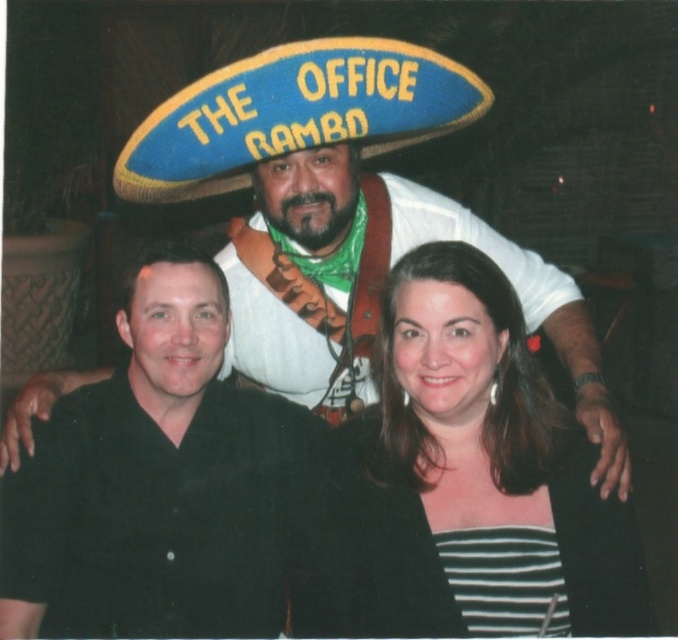
Which of these two, matte black blazer at center or white matte sombrero at upper center, stands shorter?

matte black blazer at center

Who is more distant from viewer, (388,291) or (521,280)?

Positioned behind is point (521,280).

Image resolution: width=678 pixels, height=640 pixels. I want to click on matte black blazer at center, so click(x=460, y=481).

Is white matte sombrero at upper center above black matte shirt at left?

Yes, white matte sombrero at upper center is above black matte shirt at left.

Locate an element on the screen. white matte sombrero at upper center is located at coordinates (296, 182).

Describe the element at coordinates (460, 481) in the screenshot. I see `matte black blazer at center` at that location.

Does matte black blazer at center have a smaller size compared to black matte shirt at left?

Yes.

Between point (414, 365) and point (92, 576), which one is positioned behind?

The point (92, 576) is more distant.

Identify the location of matte black blazer at center. (460, 481).